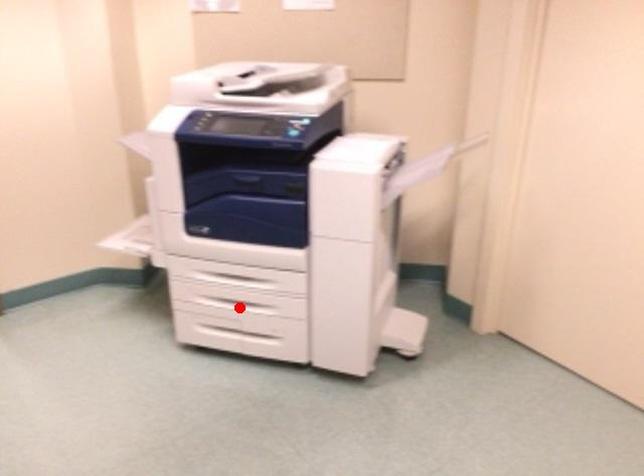
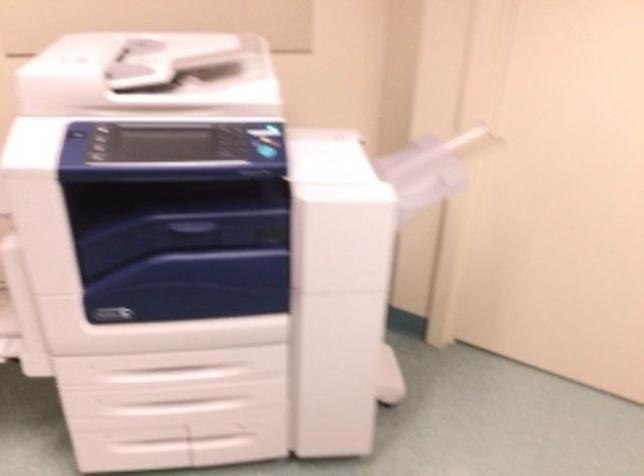
Question: I am providing you with two images of the same scene from different viewpoints. Image1 has a red point marked. In image2, the corresponding 3D location appears at what relative position? Reply with the corresponding letter.

Choices:
 (A) Closer
 (B) Farther

Answer: (A)